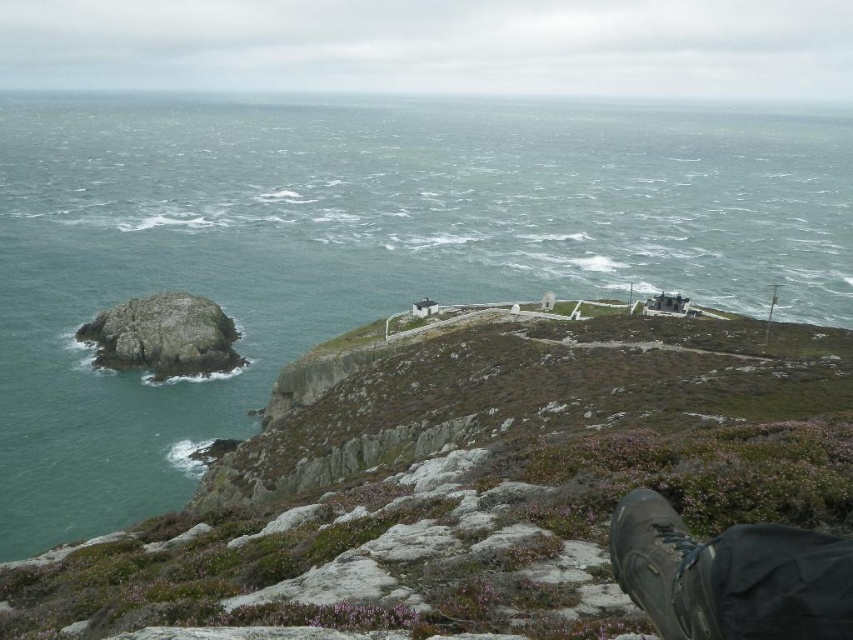
Who is more distant from viewer, (x=833, y=600) or (x=641, y=609)?

Positioned behind is point (x=641, y=609).

Does brown suede boot at lower right appear on the left side of black leather boot at lower right?

In fact, brown suede boot at lower right is to the right of black leather boot at lower right.

Describe the element at coordinates (730, 577) in the screenshot. I see `brown suede boot at lower right` at that location.

Locate an element on the screen. brown suede boot at lower right is located at coordinates (730, 577).

Between green mossy rock at upper center and black leather boot at lower right, which one has more height?

With more height is green mossy rock at upper center.

Is green mossy rock at upper center smaller than black leather boot at lower right?

No.

Image resolution: width=853 pixels, height=640 pixels. What do you see at coordinates (468, 481) in the screenshot?
I see `green mossy rock at upper center` at bounding box center [468, 481].

Where is `green mossy rock at upper center`? green mossy rock at upper center is located at coordinates (468, 481).

Which of these two, green mossy rock at upper center or brown suede boot at lower right, stands shorter?

With less height is brown suede boot at lower right.

Who is more forward, (781,360) or (793,611)?

Point (793,611)

Locate an element on the screen. The height and width of the screenshot is (640, 853). green mossy rock at upper center is located at coordinates (x=468, y=481).

I want to click on green mossy rock at upper center, so click(468, 481).